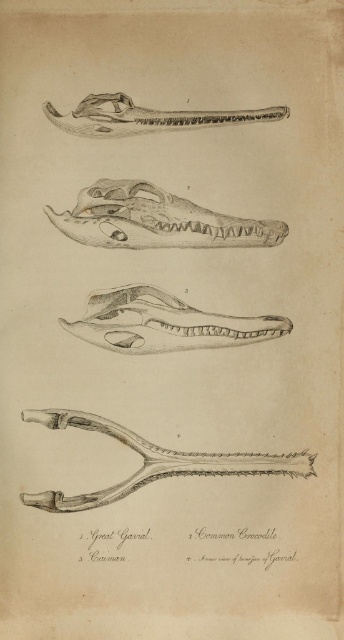
In the scene shown: You are an art student analyzing the positions of two points in the image. The first point is at coordinates point [132,212] and the second point is at point [241,316]. Based on their positions, which point is closer to the front of the image?

Point [132,212] is in front of point [241,316], so it is closer to the front of the image.

You are an anthropologist studying the arrangement of these skulls. The matte black skull at center is positioned at coordinates point 0.345, 0.453. If you were to draw a straight line from the origin point 0,0 to this coordinate, in which cardinal direction would this line point?

The line from the origin (0, 0) to the matte black skull at center at point (155, 220) would point towards the northeast direction since both x and y coordinates are positive and increasing.

In the scene shown: Looking at the image of animal skulls, which object is located at the coordinates point (155, 220)?

The point (155, 220) corresponds to the matte black skull at center.